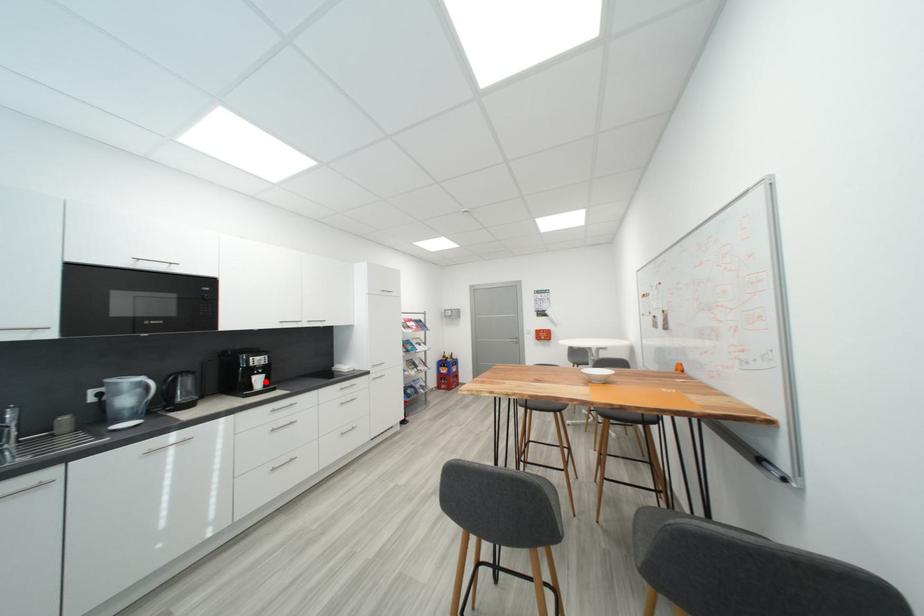
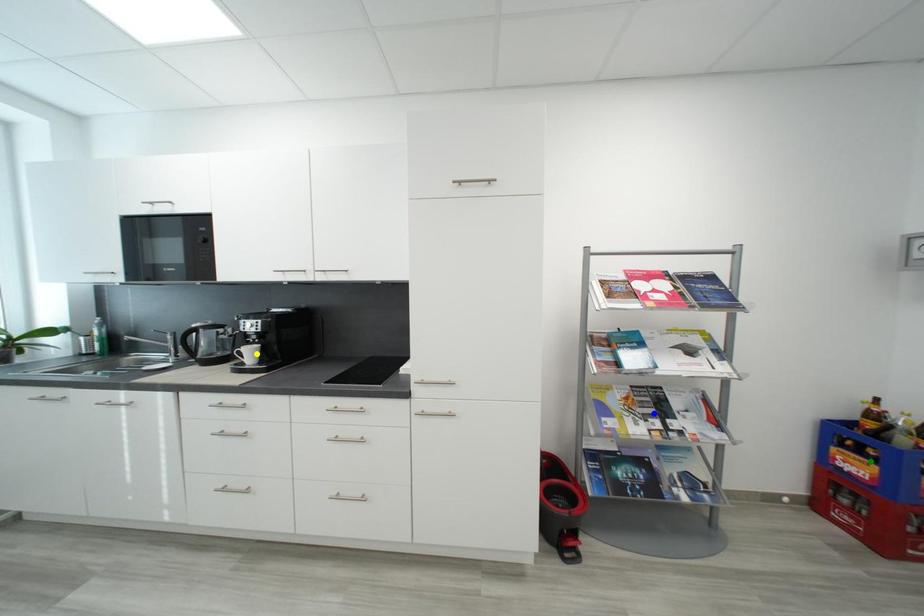
Question: I am providing you with two images of the same scene from different viewpoints. A red point is marked on the first image. You are given multiple points on the second image. Can you choose the point in image 2 that corresponds to the point in image 1?

Choices:
 (A) green point
 (B) blue point
 (C) yellow point

Answer: (C)